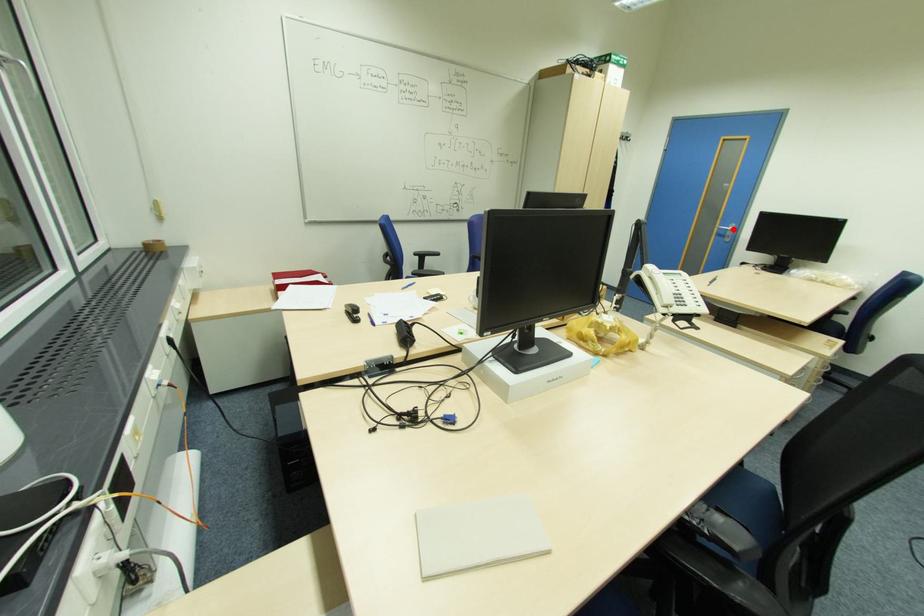
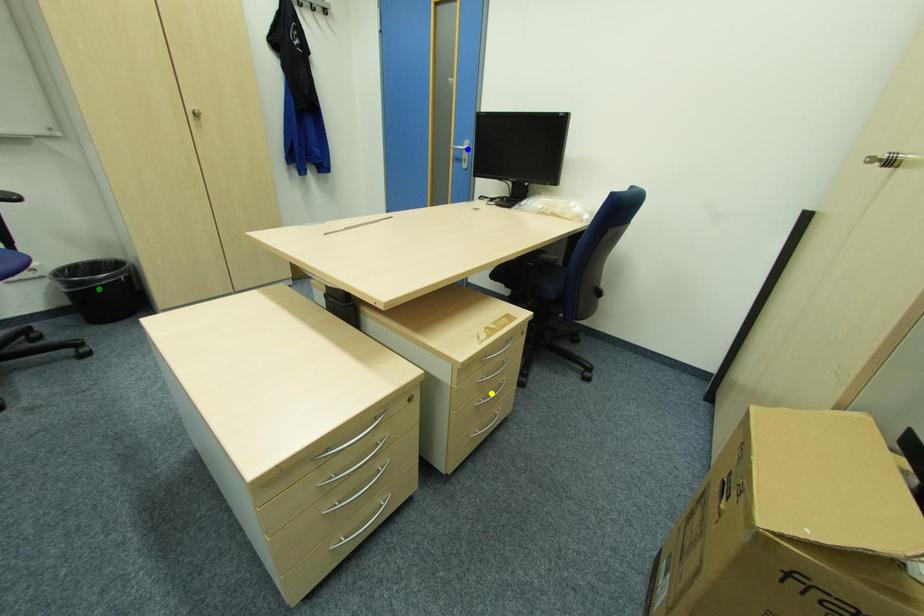
Question: I am providing you with two images of the same scene from different viewpoints. A red point is marked on the first image. You are given multiple points on the second image. Which spot in image 2 lines up with the point in image 1?

Choices:
 (A) yellow point
 (B) green point
 (C) blue point

Answer: (C)